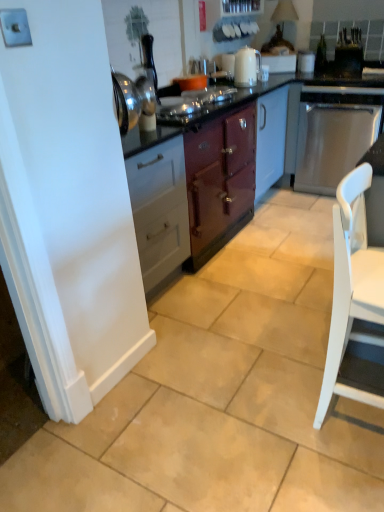
What do you see at coordinates (306, 61) in the screenshot? I see `white glossy cup at upper center, marked as the first appliance in a left-to-right arrangement` at bounding box center [306, 61].

What are the coordinates of `white glossy cup at upper center, marked as the first appliance in a left-to-right arrangement` in the screenshot? It's located at 306,61.

Is satin black toaster at upper right, which is the 1th appliance in right-to-left order, located within white matte chair at lower right?

No, white matte chair at lower right does not contain satin black toaster at upper right, which is the 1th appliance in right-to-left order.

Between white matte chair at lower right and satin black toaster at upper right, which is the 1th appliance in right-to-left order, which one has larger width?

white matte chair at lower right is wider.

Does white matte chair at lower right turn towards satin black toaster at upper right, which appears as the second appliance when viewed from the left?

No, white matte chair at lower right does not turn towards satin black toaster at upper right, which appears as the second appliance when viewed from the left.

From a real-world perspective, is white matte chair at lower right above or below satin black toaster at upper right, which appears as the second appliance when viewed from the left?

In terms of real-world spatial position, white matte chair at lower right is below satin black toaster at upper right, which appears as the second appliance when viewed from the left.

From the image's perspective, between satin black toaster at upper right, which is the 1th appliance in right-to-left order, and white glossy electric kettle at upper center, the first kitchen appliance when ordered from left to right, which one is located above?

satin black toaster at upper right, which is the 1th appliance in right-to-left order, is shown above in the image.

Which object is positioned more to the right, satin black toaster at upper right, which is the 1th appliance in right-to-left order, or white glossy electric kettle at upper center, the first kitchen appliance when ordered from left to right?

Positioned to the right is satin black toaster at upper right, which is the 1th appliance in right-to-left order.

From the image's perspective, which kitchen appliance is the 1st one below the satin black toaster at upper right, which appears as the second appliance when viewed from the left? Please provide its 2D coordinates.

[(246, 67)]

Which object is thinner, stainless steel dishwasher at right, the 2th kitchen appliance viewed from the left, or white matte chair at lower right?

With smaller width is white matte chair at lower right.

Is white matte chair at lower right at the back of stainless steel dishwasher at right, the 2th kitchen appliance viewed from the left?

stainless steel dishwasher at right, the 2th kitchen appliance viewed from the left, does not have its back to white matte chair at lower right.

How many degrees apart are the facing directions of stainless steel dishwasher at right, the 2th kitchen appliance viewed from the left, and white matte chair at lower right?

The angle between the facing direction of stainless steel dishwasher at right, the 2th kitchen appliance viewed from the left, and the facing direction of white matte chair at lower right is 92.2 degrees.

Relative to white matte chair at lower right, is stainless steel dishwasher at right, the 2th kitchen appliance viewed from the left, in front or behind?

Clearly, stainless steel dishwasher at right, the 2th kitchen appliance viewed from the left, is behind white matte chair at lower right.

Which of these two, white glossy cup at upper center, the second appliance from the right, or satin black toaster at upper right, which appears as the second appliance when viewed from the left, is thinner?

Thinner between the two is white glossy cup at upper center, the second appliance from the right.

From a real-world perspective, which is physically below, white glossy cup at upper center, the second appliance from the right, or satin black toaster at upper right, which appears as the second appliance when viewed from the left?

satin black toaster at upper right, which appears as the second appliance when viewed from the left, from a real-world perspective.

Can you tell me how much white glossy cup at upper center, marked as the first appliance in a left-to-right arrangement, and satin black toaster at upper right, which appears as the second appliance when viewed from the left, differ in facing direction?

The angle between the facing direction of white glossy cup at upper center, marked as the first appliance in a left-to-right arrangement, and the facing direction of satin black toaster at upper right, which appears as the second appliance when viewed from the left, is 2.08 degrees.

Is satin black toaster at upper right, which is the 1th appliance in right-to-left order, aimed at white glossy cup at upper center, marked as the first appliance in a left-to-right arrangement?

No, satin black toaster at upper right, which is the 1th appliance in right-to-left order, is not facing towards white glossy cup at upper center, marked as the first appliance in a left-to-right arrangement.

Can you confirm if satin black toaster at upper right, which is the 1th appliance in right-to-left order, is bigger than white glossy cup at upper center, marked as the first appliance in a left-to-right arrangement?

Indeed, satin black toaster at upper right, which is the 1th appliance in right-to-left order, has a larger size compared to white glossy cup at upper center, marked as the first appliance in a left-to-right arrangement.

Is satin black toaster at upper right, which appears as the second appliance when viewed from the left, placed right next to white glossy cup at upper center, the second appliance from the right?

satin black toaster at upper right, which appears as the second appliance when viewed from the left, and white glossy cup at upper center, the second appliance from the right, are not in contact.

Where is `appliance behind the satin black toaster at upper right, which appears as the second appliance when viewed from the left`? appliance behind the satin black toaster at upper right, which appears as the second appliance when viewed from the left is located at coordinates (306, 61).

Is white matte chair at lower right at the back of satin black toaster at upper right, which is the 1th appliance in right-to-left order?

satin black toaster at upper right, which is the 1th appliance in right-to-left order, does not have its back to white matte chair at lower right.

Can you tell me how much satin black toaster at upper right, which is the 1th appliance in right-to-left order, and white matte chair at lower right differ in facing direction?

The facing directions of satin black toaster at upper right, which is the 1th appliance in right-to-left order, and white matte chair at lower right are 85.3 degrees apart.

Does satin black toaster at upper right, which is the 1th appliance in right-to-left order, appear on the right side of white matte chair at lower right?

Indeed, satin black toaster at upper right, which is the 1th appliance in right-to-left order, is positioned on the right side of white matte chair at lower right.

Starting from the white matte chair at lower right, which appliance is the 1st one behind? Please provide its 2D coordinates.

[(348, 60)]

This screenshot has height=512, width=384. I want to click on the 2nd kitchen appliance behind the white matte chair at lower right, starting your count from the anchor, so click(334, 134).

How many degrees apart are the facing directions of white matte chair at lower right and stainless steel dishwasher at right, the 2th kitchen appliance viewed from the left?

The facing directions of white matte chair at lower right and stainless steel dishwasher at right, the 2th kitchen appliance viewed from the left, are 92.2 degrees apart.

Is the surface of white matte chair at lower right in direct contact with stainless steel dishwasher at right, the 2th kitchen appliance viewed from the left?

white matte chair at lower right is not next to stainless steel dishwasher at right, the 2th kitchen appliance viewed from the left, and they're not touching.

The height and width of the screenshot is (512, 384). I want to click on chair below the satin black toaster at upper right, which is the 1th appliance in right-to-left order (from the image's perspective), so click(x=353, y=292).

You are a GUI agent. You are given a task and a screenshot of the screen. Output one action in this format:
    pyautogui.click(x=<x>, y=<y>)
    Task: Click on the 2nd appliance to the right of the white glossy electric kettle at upper center, which ranks as the 2th kitchen appliance in right-to-left order, counting from the anchor's position
    
    Given the screenshot: What is the action you would take?
    pyautogui.click(x=348, y=60)

Which object lies nearer to the anchor point white matte chair at lower right, stainless steel dishwasher at right, the first kitchen appliance from the right, or white glossy cup at upper center, the second appliance from the right?

stainless steel dishwasher at right, the first kitchen appliance from the right, lies closer to white matte chair at lower right than the other object.

Looking at the image, which one is located further to stainless steel dishwasher at right, the 2th kitchen appliance viewed from the left, white matte chair at lower right or white glossy electric kettle at upper center, the first kitchen appliance when ordered from left to right?

white matte chair at lower right.

Looking at this image, based on their spatial positions, is stainless steel dishwasher at right, the first kitchen appliance from the right, or satin black toaster at upper right, which appears as the second appliance when viewed from the left, further from white glossy electric kettle at upper center, which ranks as the 2th kitchen appliance in right-to-left order?

satin black toaster at upper right, which appears as the second appliance when viewed from the left, is further to white glossy electric kettle at upper center, which ranks as the 2th kitchen appliance in right-to-left order.

Looking at the image, which one is located closer to white matte chair at lower right, satin black toaster at upper right, which is the 1th appliance in right-to-left order, or white glossy electric kettle at upper center, the first kitchen appliance when ordered from left to right?

Among the two, white glossy electric kettle at upper center, the first kitchen appliance when ordered from left to right, is located nearer to white matte chair at lower right.

Based on their spatial positions, is satin black toaster at upper right, which is the 1th appliance in right-to-left order, or white matte chair at lower right further from white glossy electric kettle at upper center, which ranks as the 2th kitchen appliance in right-to-left order?

Based on the image, white matte chair at lower right appears to be further to white glossy electric kettle at upper center, which ranks as the 2th kitchen appliance in right-to-left order.

When comparing their distances from white glossy electric kettle at upper center, the first kitchen appliance when ordered from left to right, does white glossy cup at upper center, marked as the first appliance in a left-to-right arrangement, or stainless steel dishwasher at right, the 2th kitchen appliance viewed from the left, seem closer?

Among the two, white glossy cup at upper center, marked as the first appliance in a left-to-right arrangement, is located nearer to white glossy electric kettle at upper center, the first kitchen appliance when ordered from left to right.

Which object lies further to the anchor point satin black toaster at upper right, which appears as the second appliance when viewed from the left, stainless steel dishwasher at right, the first kitchen appliance from the right, or white glossy cup at upper center, marked as the first appliance in a left-to-right arrangement?

stainless steel dishwasher at right, the first kitchen appliance from the right, is further to satin black toaster at upper right, which appears as the second appliance when viewed from the left.

From the image, which object appears to be farther from satin black toaster at upper right, which is the 1th appliance in right-to-left order, white glossy cup at upper center, the second appliance from the right, or white glossy electric kettle at upper center, which ranks as the 2th kitchen appliance in right-to-left order?

white glossy electric kettle at upper center, which ranks as the 2th kitchen appliance in right-to-left order.

Find the location of a particular element. The width and height of the screenshot is (384, 512). appliance between white glossy electric kettle at upper center, the first kitchen appliance when ordered from left to right, and satin black toaster at upper right, which is the 1th appliance in right-to-left order, in the horizontal direction is located at coordinates (306, 61).

The height and width of the screenshot is (512, 384). In order to click on appliance between white glossy electric kettle at upper center, the first kitchen appliance when ordered from left to right, and stainless steel dishwasher at right, the first kitchen appliance from the right, in the horizontal direction in this screenshot , I will do `click(306, 61)`.

This screenshot has width=384, height=512. In order to click on appliance between white glossy cup at upper center, the second appliance from the right, and stainless steel dishwasher at right, the first kitchen appliance from the right, vertically in this screenshot , I will do `click(348, 60)`.

You are a GUI agent. You are given a task and a screenshot of the screen. Output one action in this format:
    pyautogui.click(x=<x>, y=<y>)
    Task: Click on the appliance between white matte chair at lower right and white glossy cup at upper center, marked as the first appliance in a left-to-right arrangement, in the front-back direction
    Image resolution: width=384 pixels, height=512 pixels.
    Given the screenshot: What is the action you would take?
    pyautogui.click(x=348, y=60)